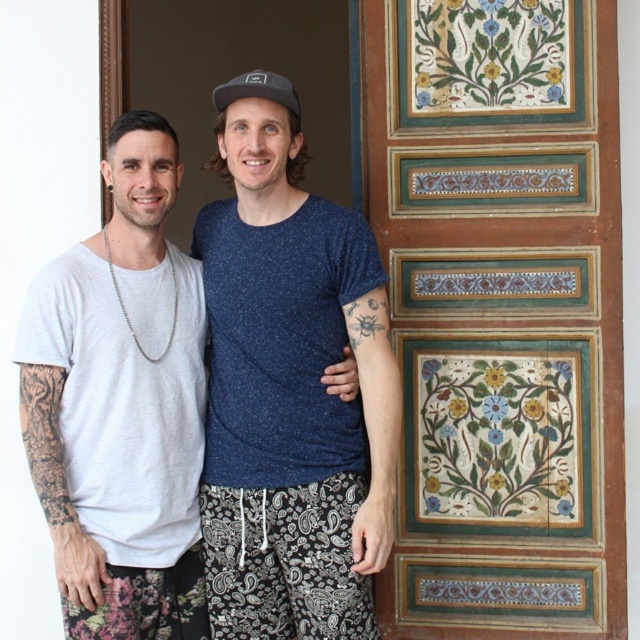
What is the exact location of the wooden panel with painted floral design at right in the image?

The wooden panel with painted floral design at right is located at point (500, 310).